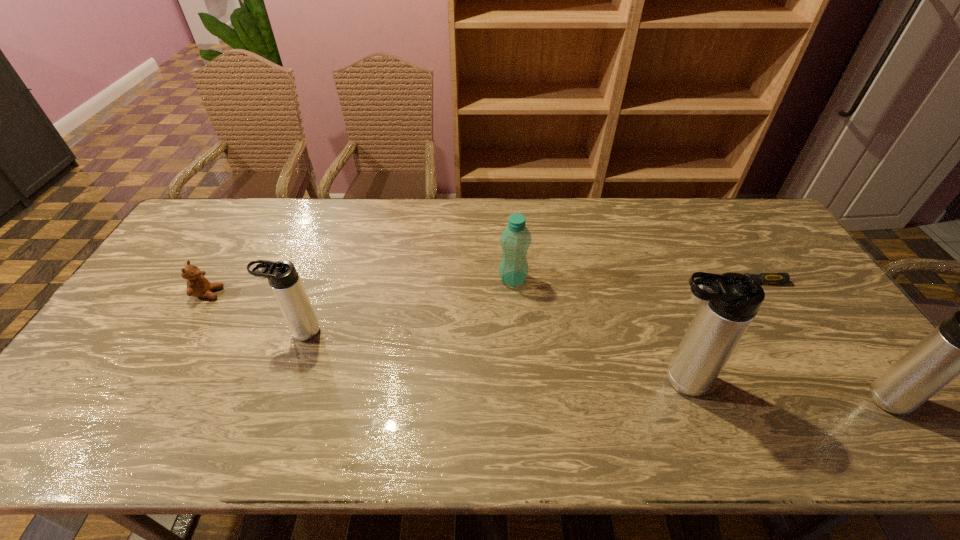
Identify the location of vacant space located 0.100m on the face of the leftmost object. (255, 293).

You are a GUI agent. You are given a task and a screenshot of the screen. Output one action in this format:
    pyautogui.click(x=<x>, y=<y>)
    Task: Click on the thermos bottle present at the right edge
    The width and height of the screenshot is (960, 540).
    Given the screenshot: What is the action you would take?
    pyautogui.click(x=959, y=345)

Where is `screwdriver that is at the right edge`? The image size is (960, 540). screwdriver that is at the right edge is located at coordinates (766, 278).

Where is `object present at the near right corner`? This screenshot has height=540, width=960. object present at the near right corner is located at coordinates (959, 345).

Locate an element on the screen. The height and width of the screenshot is (540, 960). vacant area at the far edge of the desktop is located at coordinates (552, 202).

The image size is (960, 540). In the image, there is a desktop. Identify the location of blank space at the near edge. (477, 409).

In the image, there is a desktop. What are the coordinates of `free space at the left edge` in the screenshot? It's located at (154, 326).

Find the location of a particular element. This screenshot has width=960, height=540. free space between the shortest thermos bottle and the third object from left to right is located at coordinates (406, 306).

Find the location of a particular element. vacant space that's between the fifth tallest object and the screwdriver is located at coordinates (477, 288).

Where is `free space between the shortest thermos bottle and the shortest object`? free space between the shortest thermos bottle and the shortest object is located at coordinates (523, 307).